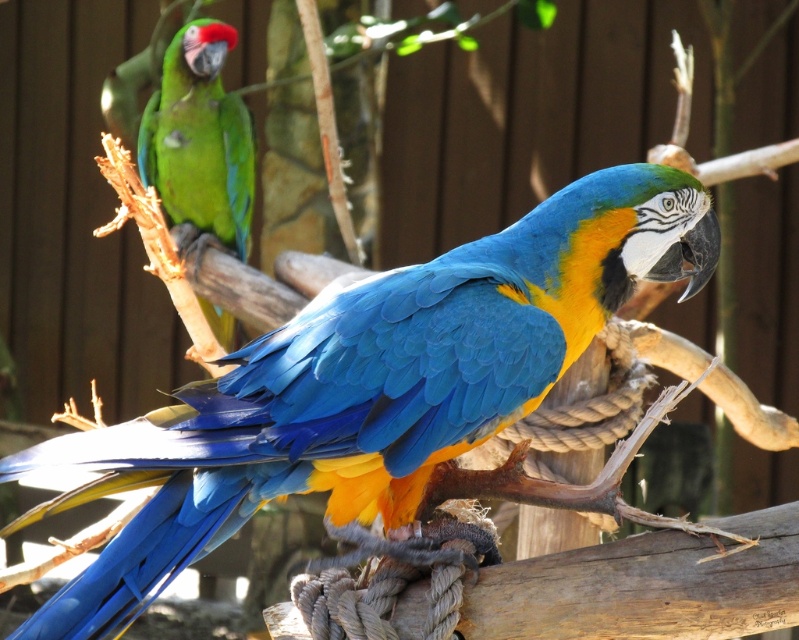
You are a zookeeper who needs to place a new feeding tray for both parrots. The tray must be positioned so that the larger parrot can reach it without disturbing the smaller one. Where should you place the feeding tray relative to the blue glossy parrot at center and the green matte parrot at upper left?

The blue glossy parrot at center is larger than the green matte parrot at upper left. To ensure the larger parrot can reach the feeding tray without disturbing the smaller one, place the tray closer to the blue glossy parrot at center but positioned in a way that the green matte parrot at upper left cannot easily access it, maintaining a safe distance between them.

You are a zookeeper observing the aviary and need to place a feeding tray between the blue glossy parrot at center and the green matte parrot at upper left. Based on their positions, which parrot will be closer to the left edge of the feeding tray once placed?

The green matte parrot at upper left will be closer to the left edge of the feeding tray because the blue glossy parrot at center is positioned to the right of it.

You are a zookeeper who needs to place a food bowl between the blue glossy parrot at center and the green matte parrot at upper left. The bowl requires a minimum of 1.5 meters of space to avoid disturbing the parrots. Is the current distance sufficient?

The distance between the blue glossy parrot at center and the green matte parrot at upper left is 2.25 meters, which exceeds the required 1.5 meters. Therefore, placing the food bowl between them will not disturb the parrots.